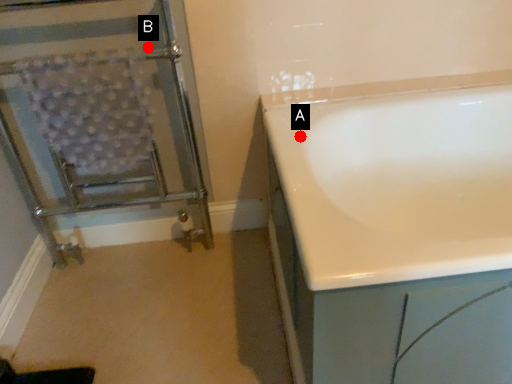
Question: Two points are circled on the image, labeled by A and B beside each circle. Which point is closer to the camera?

Choices:
 (A) A is closer
 (B) B is closer

Answer: (A)